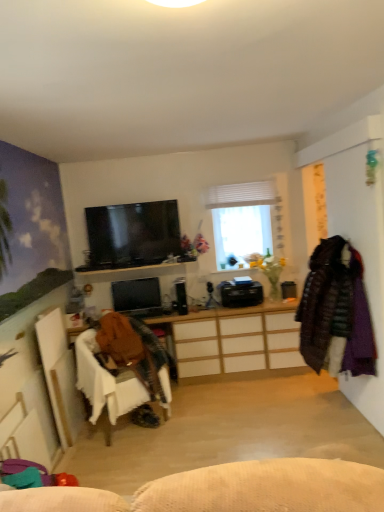
Question: Can you confirm if velvet purple coat at right is bigger than white matte window at center?

Choices:
 (A) no
 (B) yes

Answer: (B)

Question: Is the position of velvet purple coat at right more distant than that of white matte window at center?

Choices:
 (A) no
 (B) yes

Answer: (A)

Question: Is velvet purple coat at right facing towards white matte window at center?

Choices:
 (A) yes
 (B) no

Answer: (B)

Question: Considering the relative sizes of velvet purple coat at right and white matte window at center in the image provided, is velvet purple coat at right shorter than white matte window at center?

Choices:
 (A) no
 (B) yes

Answer: (A)

Question: Can you confirm if velvet purple coat at right is positioned to the right of white matte window at center?

Choices:
 (A) yes
 (B) no

Answer: (A)

Question: Does velvet purple coat at right have a greater width compared to white matte window at center?

Choices:
 (A) no
 (B) yes

Answer: (B)

Question: From a real-world perspective, is dark brown quilted coat at right, marked as the first clothing in a right-to-left arrangement, located higher than matte black monitor at center, positioned as the first television in bottom-to-top order?

Choices:
 (A) yes
 (B) no

Answer: (A)

Question: Is dark brown quilted coat at right, the second clothing when ordered from left to right, next to matte black monitor at center, positioned as the first television in bottom-to-top order, and touching it?

Choices:
 (A) yes
 (B) no

Answer: (B)

Question: Is dark brown quilted coat at right, the second clothing when ordered from left to right, closer to camera compared to matte black monitor at center, positioned as the first television in bottom-to-top order?

Choices:
 (A) no
 (B) yes

Answer: (B)

Question: Does dark brown quilted coat at right, marked as the first clothing in a right-to-left arrangement, have a lesser width compared to matte black monitor at center, which is counted as the 2th television, starting from the front?

Choices:
 (A) yes
 (B) no

Answer: (B)

Question: Can matte black monitor at center, which ranks as the 2th television in top-to-bottom order, be found inside dark brown quilted coat at right, the second clothing when ordered from left to right?

Choices:
 (A) yes
 (B) no

Answer: (B)

Question: Considering the relative sizes of dark brown quilted coat at right, marked as the first clothing in a right-to-left arrangement, and matte black monitor at center, positioned as the first television in bottom-to-top order, in the image provided, is dark brown quilted coat at right, marked as the first clothing in a right-to-left arrangement, wider than matte black monitor at center, positioned as the first television in bottom-to-top order,?

Choices:
 (A) yes
 (B) no

Answer: (A)

Question: From a real-world perspective, is wooden desk at center positioned over matte black monitor at center, which ranks as the 2th television in top-to-bottom order, based on gravity?

Choices:
 (A) yes
 (B) no

Answer: (B)